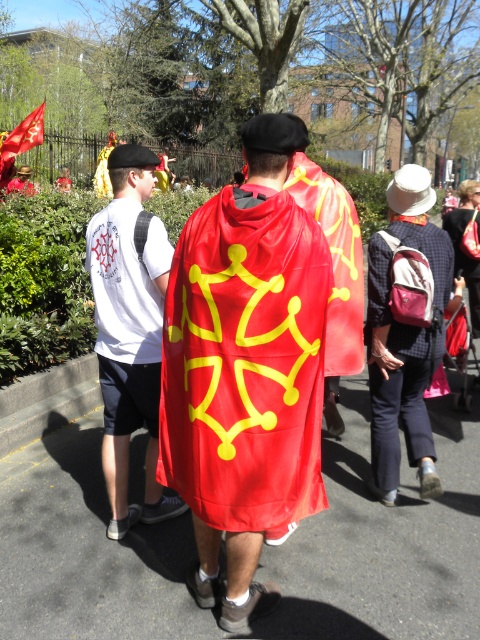
Consider the image. You are organizing a parade and need to decide which object can cover a larger area when displayed. Based on the scene, which one between the matte red cape at center and the red fabric flag at upper left is wider?

The matte red cape at center is wider than the red fabric flag at upper left, so it can cover a larger area when displayed.

You are an event organizer planning to place a new banner between the shiny red cape at center and the red fabric flag at upper left. Based on the scene description, which object should the banner be placed to the right of?

The banner should be placed to the right of the shiny red cape at center because the shiny red cape at center is positioned on the right side of the red fabric flag at upper left.